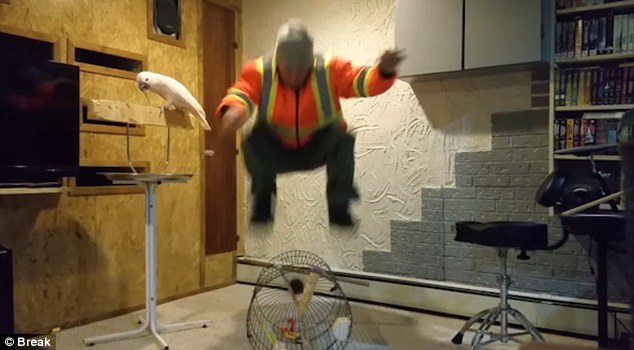
Locate an element on the screen. The width and height of the screenshot is (634, 350). right white cupboard is located at coordinates (506, 31).